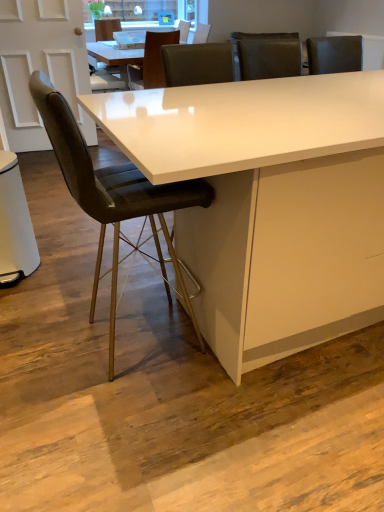
Measure the distance between white glossy table at center and camera.

white glossy table at center is 1.04 meters away from camera.

What do you see at coordinates (269, 203) in the screenshot? I see `white glossy table at center` at bounding box center [269, 203].

This screenshot has width=384, height=512. What do you see at coordinates (151, 62) in the screenshot?
I see `leather at center, the 2th chair in the bottom-to-top sequence` at bounding box center [151, 62].

Identify the location of leather-like black chair at left, the first chair from the front. (114, 196).

Is there a large distance between matte black chair at upper center, which ranks as the 1th chair in top-to-bottom order, and white glossy table at center?

matte black chair at upper center, which ranks as the 1th chair in top-to-bottom order, is positioned a significant distance from white glossy table at center.

From a real-world perspective, is matte black chair at upper center, which ranks as the 1th chair in top-to-bottom order, beneath white glossy table at center?

No, from a real-world perspective, matte black chair at upper center, which ranks as the 1th chair in top-to-bottom order, is not below white glossy table at center.

Between matte black chair at upper center, the third chair in the bottom-to-top sequence, and white glossy table at center, which one appears on the left side from the viewer's perspective?

matte black chair at upper center, the third chair in the bottom-to-top sequence.

Does leather at center, the 2th chair from the front, appear on the left side of leather-like black chair at left, positioned as the first chair in bottom-to-top order?

Indeed, leather at center, the 2th chair from the front, is positioned on the left side of leather-like black chair at left, positioned as the first chair in bottom-to-top order.

Is leather at center, arranged as the 2th chair when viewed from the back, touching leather-like black chair at left, which is the 3th chair from top to bottom?

leather at center, arranged as the 2th chair when viewed from the back, and leather-like black chair at left, which is the 3th chair from top to bottom, are not in contact.

Looking at this image, from the image's perspective, is leather at center, the 2th chair in the bottom-to-top sequence, below leather-like black chair at left, which is the 3th chair from top to bottom?

No.

Is leather at center, positioned as the 2th chair in top-to-bottom order, positioned with its back to leather-like black chair at left, arranged as the third chair when viewed from the back?

That's not correct — leather at center, positioned as the 2th chair in top-to-bottom order, is not looking away from leather-like black chair at left, arranged as the third chair when viewed from the back.

Where is `table below the leather-like black chair at left, positioned as the first chair in bottom-to-top order (from a real-world perspective)`? table below the leather-like black chair at left, positioned as the first chair in bottom-to-top order (from a real-world perspective) is located at coordinates (269, 203).

From the image's perspective, does leather-like black chair at left, the first chair from the front, appear lower than white glossy table at center?

Indeed, from the image's perspective, leather-like black chair at left, the first chair from the front, is shown beneath white glossy table at center.

Would you say leather-like black chair at left, arranged as the third chair when viewed from the back, is outside white glossy table at center?

No, leather-like black chair at left, arranged as the third chair when viewed from the back, is not outside of white glossy table at center.

What's the angular difference between leather-like black chair at left, arranged as the third chair when viewed from the back, and white glossy table at center's facing directions?

88.3 degrees.

From a real-world perspective, who is located higher, white glossy table at center or matte black chair at upper center, positioned as the third chair in front-to-back order?

In real-world perspective, matte black chair at upper center, positioned as the third chair in front-to-back order, is above.

Considering their positions, is white glossy table at center located in front of or behind matte black chair at upper center, positioned as the third chair in front-to-back order?

white glossy table at center is positioned closer to the viewer than matte black chair at upper center, positioned as the third chair in front-to-back order.

Is white glossy table at center next to matte black chair at upper center, positioned as the 1th chair in back-to-front order, and touching it?

No, white glossy table at center is not touching matte black chair at upper center, positioned as the 1th chair in back-to-front order.

Considering the positions of objects white glossy table at center and matte black chair at upper center, the third chair in the bottom-to-top sequence, in the image provided, who is more to the left, white glossy table at center or matte black chair at upper center, the third chair in the bottom-to-top sequence,?

matte black chair at upper center, the third chair in the bottom-to-top sequence.

Would you say leather at center, the 2th chair in the bottom-to-top sequence, is a long distance from matte black chair at upper center, which ranks as the 1th chair in top-to-bottom order?

No, there isn't a large distance between leather at center, the 2th chair in the bottom-to-top sequence, and matte black chair at upper center, which ranks as the 1th chair in top-to-bottom order.

Do you think leather at center, the 2th chair from the front, is within matte black chair at upper center, which ranks as the 1th chair in top-to-bottom order, or outside of it?

leather at center, the 2th chair from the front, cannot be found inside matte black chair at upper center, which ranks as the 1th chair in top-to-bottom order.

Is leather at center, the 2th chair in the bottom-to-top sequence, oriented away from matte black chair at upper center, positioned as the third chair in front-to-back order?

No, leather at center, the 2th chair in the bottom-to-top sequence, is not facing the opposite direction of matte black chair at upper center, positioned as the third chair in front-to-back order.

In the image, is leather at center, the 2th chair from the front, positioned in front of or behind matte black chair at upper center, the third chair in the bottom-to-top sequence?

Visually, leather at center, the 2th chair from the front, is located in front of matte black chair at upper center, the third chair in the bottom-to-top sequence.

Which object is thinner, leather-like black chair at left, which is the 3th chair from top to bottom, or matte black chair at upper center, positioned as the third chair in front-to-back order?

leather-like black chair at left, which is the 3th chair from top to bottom, is thinner.

From their relative heights in the image, would you say leather-like black chair at left, positioned as the first chair in bottom-to-top order, is taller or shorter than matte black chair at upper center, the third chair in the bottom-to-top sequence?

Clearly, leather-like black chair at left, positioned as the first chair in bottom-to-top order, is taller compared to matte black chair at upper center, the third chair in the bottom-to-top sequence.

Is leather-like black chair at left, arranged as the third chair when viewed from the back, aimed at matte black chair at upper center, positioned as the third chair in front-to-back order?

No.

From the image's perspective, is leather-like black chair at left, which is the 3th chair from top to bottom, located above or below matte black chair at upper center, the third chair in the bottom-to-top sequence?

Based on their image positions, leather-like black chair at left, which is the 3th chair from top to bottom, is located beneath matte black chair at upper center, the third chair in the bottom-to-top sequence.

Is matte black chair at upper center, which ranks as the 1th chair in top-to-bottom order, wider or thinner than leather at center, arranged as the 2th chair when viewed from the back?

Considering their sizes, matte black chair at upper center, which ranks as the 1th chair in top-to-bottom order, looks slimmer than leather at center, arranged as the 2th chair when viewed from the back.

From the image's perspective, which is below, matte black chair at upper center, which ranks as the 1th chair in top-to-bottom order, or leather at center, positioned as the 2th chair in top-to-bottom order?

leather at center, positioned as the 2th chair in top-to-bottom order, is shown below in the image.

Between matte black chair at upper center, which ranks as the 1th chair in top-to-bottom order, and leather at center, the 2th chair from the front, which one has more height?

matte black chair at upper center, which ranks as the 1th chair in top-to-bottom order, is taller.

The height and width of the screenshot is (512, 384). I want to click on chair that is the 3rd object above the white glossy table at center (from a real-world perspective), so click(106, 29).

Find the location of a particular element. The width and height of the screenshot is (384, 512). chair that appears below the leather at center, positioned as the 2th chair in top-to-bottom order (from the image's perspective) is located at coordinates (114, 196).

From the image, which object appears to be nearer to white glossy table at center, leather-like black chair at left, which is the 3th chair from top to bottom, or matte black chair at upper center, the third chair in the bottom-to-top sequence?

leather-like black chair at left, which is the 3th chair from top to bottom.

From the picture: Estimate the real-world distances between objects in this image. Which object is closer to leather at center, arranged as the 2th chair when viewed from the back, matte black chair at upper center, positioned as the 1th chair in back-to-front order, or leather-like black chair at left, which is the 3th chair from top to bottom?

The object closer to leather at center, arranged as the 2th chair when viewed from the back, is matte black chair at upper center, positioned as the 1th chair in back-to-front order.

Based on their spatial positions, is matte black chair at upper center, positioned as the 1th chair in back-to-front order, or leather at center, positioned as the 2th chair in top-to-bottom order, closer to leather-like black chair at left, which is the 3th chair from top to bottom?

Result: leather at center, positioned as the 2th chair in top-to-bottom order, is positioned closer to the anchor leather-like black chair at left, which is the 3th chair from top to bottom.

Which object lies nearer to the anchor point white glossy table at center, leather at center, the 2th chair from the front, or leather-like black chair at left, the first chair from the front?

Based on the image, leather-like black chair at left, the first chair from the front, appears to be nearer to white glossy table at center.

Estimate the real-world distances between objects in this image. Which object is closer to white glossy table at center, matte black chair at upper center, which ranks as the 1th chair in top-to-bottom order, or leather-like black chair at left, which is the 3th chair from top to bottom?

leather-like black chair at left, which is the 3th chair from top to bottom, is closer to white glossy table at center.

Which object lies further to the anchor point white glossy table at center, leather-like black chair at left, arranged as the third chair when viewed from the back, or leather at center, positioned as the 2th chair in top-to-bottom order?

leather at center, positioned as the 2th chair in top-to-bottom order.

Considering their positions, is leather at center, arranged as the 2th chair when viewed from the back, positioned further to leather-like black chair at left, which is the 3th chair from top to bottom, than matte black chair at upper center, positioned as the third chair in front-to-back order?

matte black chair at upper center, positioned as the third chair in front-to-back order.

Looking at the image, which one is located further to matte black chair at upper center, the third chair in the bottom-to-top sequence, leather at center, positioned as the 2th chair in top-to-bottom order, or leather-like black chair at left, arranged as the third chair when viewed from the back?

Based on the image, leather-like black chair at left, arranged as the third chair when viewed from the back, appears to be further to matte black chair at upper center, the third chair in the bottom-to-top sequence.

Find the location of `chair positioned between leather-like black chair at left, arranged as the third chair when viewed from the back, and matte black chair at upper center, the third chair in the bottom-to-top sequence, from near to far`. chair positioned between leather-like black chair at left, arranged as the third chair when viewed from the back, and matte black chair at upper center, the third chair in the bottom-to-top sequence, from near to far is located at coordinates (151, 62).

Locate an element on the screen. This screenshot has width=384, height=512. chair between white glossy table at center and leather at center, positioned as the 2th chair in top-to-bottom order, in the front-back direction is located at coordinates (114, 196).